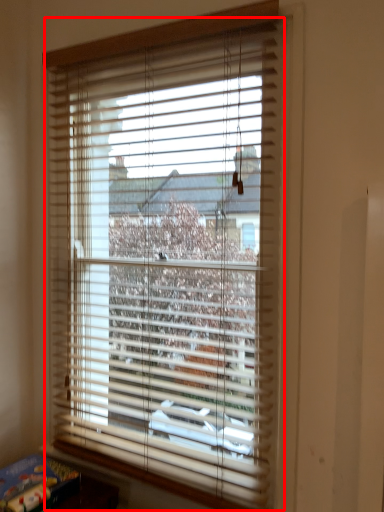
Question: From the image's perspective, what is the correct spatial positioning of window blind (annotated by the red box) in reference to paperback book?

Choices:
 (A) above
 (B) below

Answer: (A)